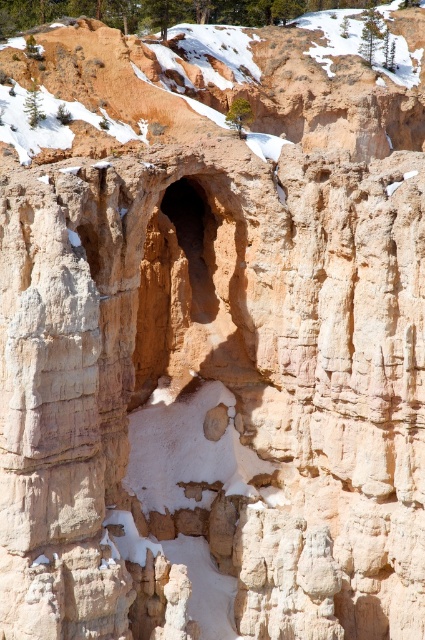
Question: Is smooth sandstone canyon at center closer to the viewer compared to rustic sandstone cave at center?

Choices:
 (A) no
 (B) yes

Answer: (A)

Question: Can you confirm if smooth sandstone canyon at center is positioned below rustic sandstone cave at center?

Choices:
 (A) yes
 (B) no

Answer: (B)

Question: Is smooth sandstone canyon at center smaller than rustic sandstone cave at center?

Choices:
 (A) yes
 (B) no

Answer: (B)